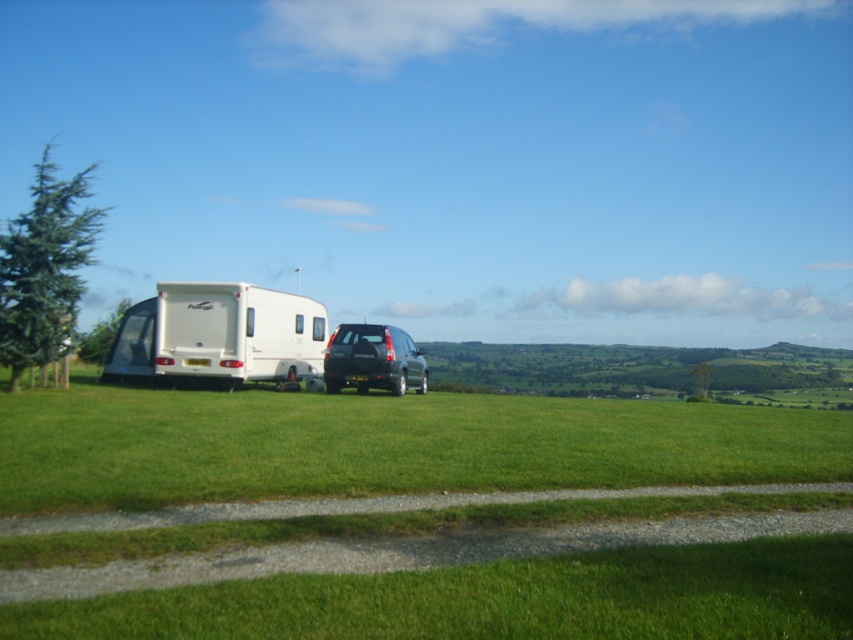
Which of these two, white glossy camper at left or black plastic license plate at center, stands taller?

white glossy camper at left is taller.

Between point (262, 337) and point (357, 376), which one is positioned behind?

Positioned behind is point (262, 337).

Find the location of a particular element. white glossy camper at left is located at coordinates (218, 336).

Consider the image. Is white glossy camper at left thinner than satin black suv at center?

In fact, white glossy camper at left might be wider than satin black suv at center.

Who is positioned more to the left, white glossy camper at left or satin black suv at center?

white glossy camper at left is more to the left.

At what (x,y) coordinates should I click in order to perform the action: click on white glossy camper at left. Please return your answer as a coordinate pair (x, y). Looking at the image, I should click on (218, 336).

Is satin black suv at center below black plastic license plate at center?

No, satin black suv at center is not below black plastic license plate at center.

Which is more to the right, satin black suv at center or black plastic license plate at center?

satin black suv at center is more to the right.

This screenshot has width=853, height=640. Identify the location of satin black suv at center. (373, 358).